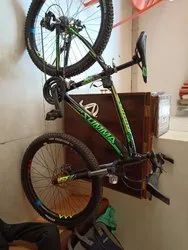
Locate an element on the screen. The width and height of the screenshot is (188, 250). pink chair is located at coordinates (140, 5).